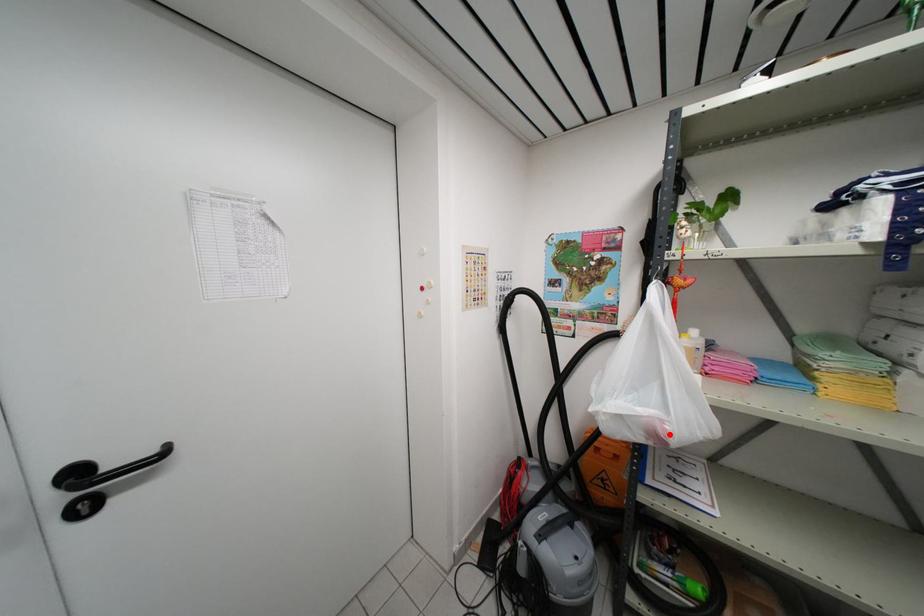
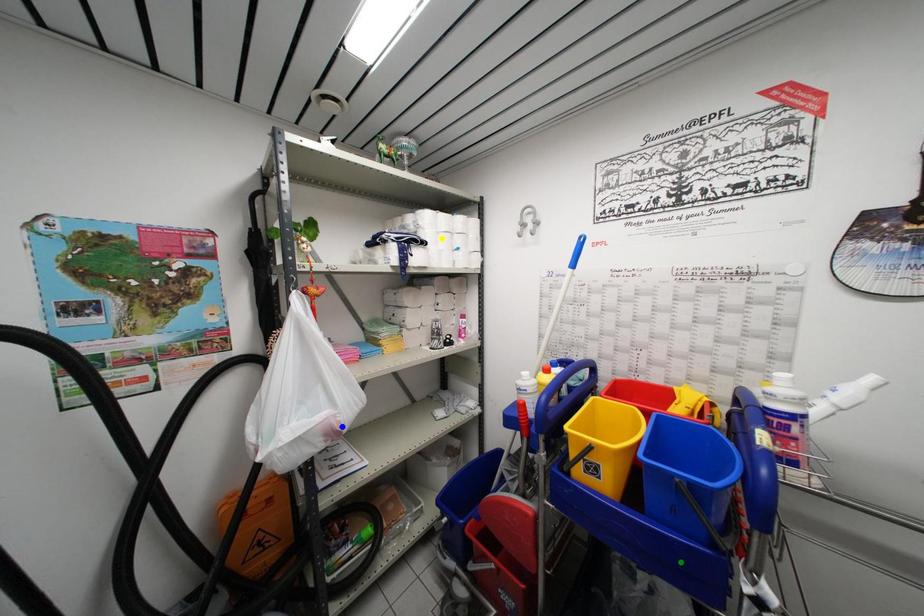
Question: I am providing you with two images of the same scene from different viewpoints. A red point is marked on the first image. You are given multiple points on the second image. Which point in image 2 represents the same 3d spot as the red point in image 1?

Choices:
 (A) yellow point
 (B) green point
 (C) blue point

Answer: (C)